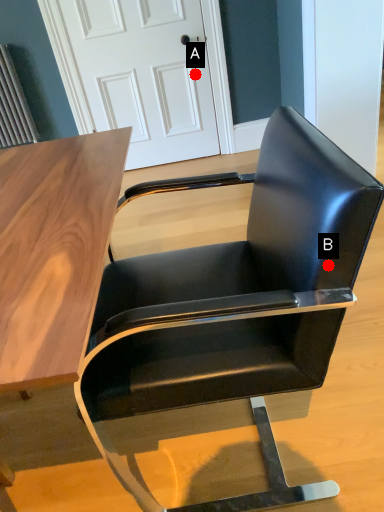
Question: Two points are circled on the image, labeled by A and B beside each circle. Which point is closer to the camera?

Choices:
 (A) A is closer
 (B) B is closer

Answer: (B)